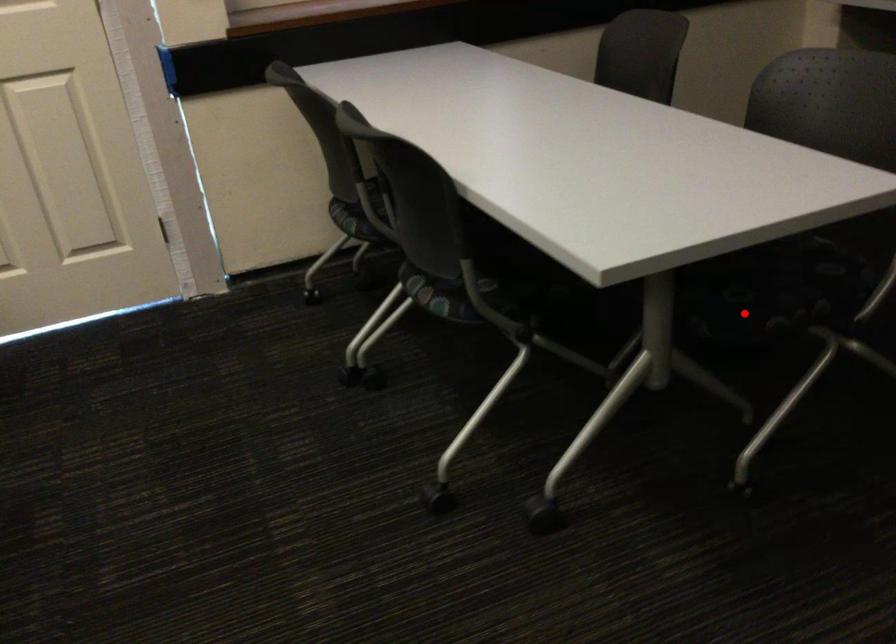
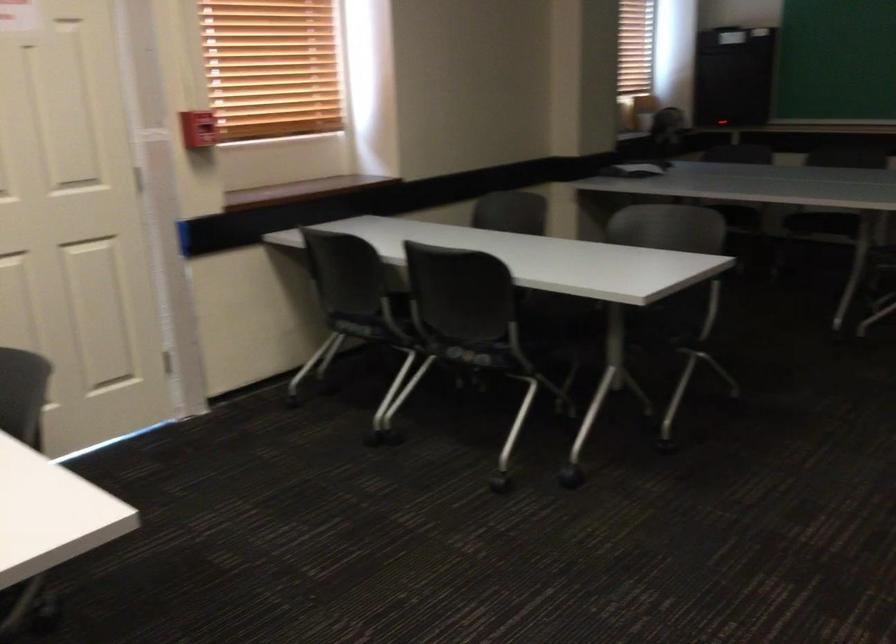
Question: I am providing you with two images of the same scene from different viewpoints. Image1 has a red point marked. In image2, the corresponding 3D location appears at what relative position? Reply with the corresponding letter.

Choices:
 (A) Closer
 (B) Farther

Answer: (B)